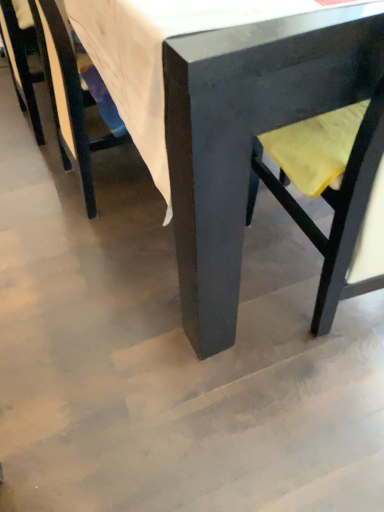
Question: From a real-world perspective, does yellow fabric swivel chair at right stand above matte black chair at center, the 1th chair positioned from the right?

Choices:
 (A) no
 (B) yes

Answer: (B)

Question: Is yellow fabric swivel chair at right taller than matte black chair at center, which is counted as the 3th chair, starting from the left?

Choices:
 (A) no
 (B) yes

Answer: (A)

Question: Can you confirm if yellow fabric swivel chair at right is shorter than matte black chair at center, the 1th chair positioned from the right?

Choices:
 (A) yes
 (B) no

Answer: (A)

Question: Is matte black chair at center, the 1th chair positioned from the right, completely or partially inside yellow fabric swivel chair at right?

Choices:
 (A) no
 (B) yes

Answer: (A)

Question: From a real-world perspective, is yellow fabric swivel chair at right beneath matte black chair at center, which is counted as the 3th chair, starting from the left?

Choices:
 (A) yes
 (B) no

Answer: (B)

Question: From their relative heights in the image, would you say matte black chair at center, which is counted as the 3th chair, starting from the left, is taller or shorter than matte black chair at lower left, which is the second chair from right to left?

Choices:
 (A) short
 (B) tall

Answer: (B)

Question: Is matte black chair at center, which is counted as the 3th chair, starting from the left, wider or thinner than matte black chair at lower left, which is the second chair in left-to-right order?

Choices:
 (A) wide
 (B) thin

Answer: (A)

Question: Considering the positions of point (198, 233) and point (77, 109), is point (198, 233) closer or farther from the camera than point (77, 109)?

Choices:
 (A) farther
 (B) closer

Answer: (B)

Question: From a real-world perspective, is matte black chair at center, which is counted as the 3th chair, starting from the left, above or below matte black chair at lower left, which is the second chair from right to left?

Choices:
 (A) above
 (B) below

Answer: (A)

Question: From the image's perspective, is matte black chair at center, which is counted as the 3th chair, starting from the left, positioned above or below yellow fabric swivel chair at right?

Choices:
 (A) below
 (B) above

Answer: (B)

Question: Choose the correct answer: Is matte black chair at center, the 1th chair positioned from the right, inside yellow fabric swivel chair at right or outside it?

Choices:
 (A) inside
 (B) outside

Answer: (B)

Question: Considering the positions of point (213, 50) and point (350, 106), is point (213, 50) closer or farther from the camera than point (350, 106)?

Choices:
 (A) closer
 (B) farther

Answer: (A)

Question: From a real-world perspective, is matte black chair at center, which is counted as the 3th chair, starting from the left, physically located above or below yellow fabric swivel chair at right?

Choices:
 (A) below
 (B) above

Answer: (A)

Question: Is matte black chair at lower left, which is the second chair in left-to-right order, taller or shorter than matte black chair at center, which is counted as the 3th chair, starting from the left?

Choices:
 (A) short
 (B) tall

Answer: (A)

Question: From the image's perspective, relative to matte black chair at center, which is counted as the 3th chair, starting from the left, is matte black chair at lower left, which is the second chair in left-to-right order, above or below?

Choices:
 (A) above
 (B) below

Answer: (B)